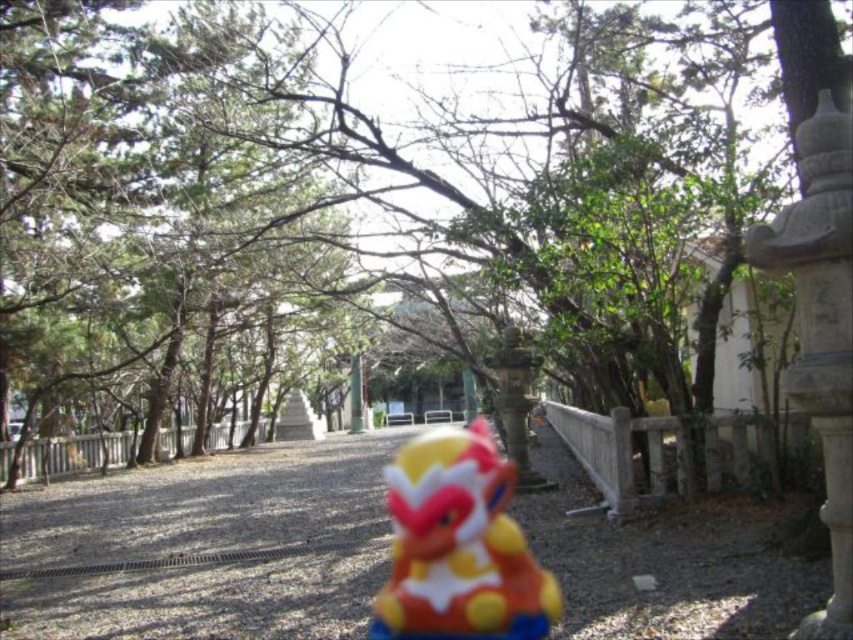
Question: Which point appears farthest from the camera in this image?

Choices:
 (A) (119, 554)
 (B) (480, 598)

Answer: (A)

Question: Does smooth gravel path at center have a lesser width compared to matte plastic toy at center?

Choices:
 (A) yes
 (B) no

Answer: (B)

Question: Observing the image, what is the correct spatial positioning of smooth gravel path at center in reference to matte plastic toy at center?

Choices:
 (A) right
 (B) left

Answer: (B)

Question: Is smooth gravel path at center positioned behind matte plastic toy at center?

Choices:
 (A) yes
 (B) no

Answer: (B)